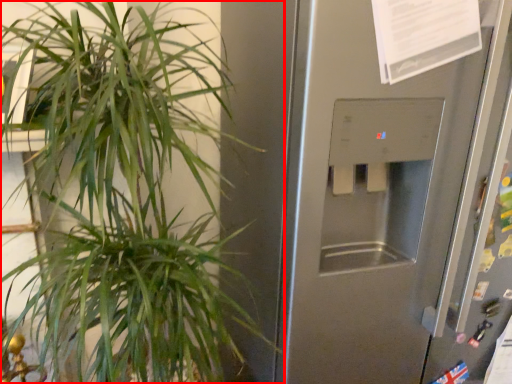
Question: From the image's perspective, considering the relative positions of houseplant (annotated by the red box) and screen door in the image provided, where is houseplant (annotated by the red box) located with respect to the staircase?

Choices:
 (A) above
 (B) below

Answer: (B)